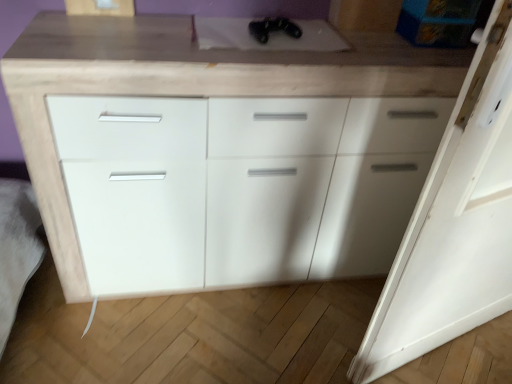
Question: Considering the relative sizes of black matte controller at upper center and white matte door at right in the image provided, is black matte controller at upper center taller than white matte door at right?

Choices:
 (A) no
 (B) yes

Answer: (A)

Question: Does black matte controller at upper center have a smaller size compared to white matte door at right?

Choices:
 (A) no
 (B) yes

Answer: (B)

Question: Is black matte controller at upper center positioned with its back to white matte door at right?

Choices:
 (A) no
 (B) yes

Answer: (A)

Question: From a real-world perspective, is black matte controller at upper center positioned under white matte door at right based on gravity?

Choices:
 (A) no
 (B) yes

Answer: (A)

Question: Is black matte controller at upper center thinner than white matte door at right?

Choices:
 (A) no
 (B) yes

Answer: (A)

Question: From a real-world perspective, is black matte controller at upper center over white matte door at right?

Choices:
 (A) no
 (B) yes

Answer: (B)

Question: Is white matte door at right shorter than black matte controller at upper center?

Choices:
 (A) yes
 (B) no

Answer: (B)

Question: Is white matte door at right not within black matte controller at upper center?

Choices:
 (A) no
 (B) yes

Answer: (B)

Question: Is white matte door at right turned away from black matte controller at upper center?

Choices:
 (A) yes
 (B) no

Answer: (A)

Question: From a real-world perspective, is white matte door at right located higher than black matte controller at upper center?

Choices:
 (A) no
 (B) yes

Answer: (A)

Question: Can you confirm if white matte door at right is smaller than black matte controller at upper center?

Choices:
 (A) no
 (B) yes

Answer: (A)

Question: Does white matte door at right appear on the left side of black matte controller at upper center?

Choices:
 (A) no
 (B) yes

Answer: (A)

Question: Is white matte door at right closer to the viewer compared to white matte cabinet at center?

Choices:
 (A) no
 (B) yes

Answer: (B)